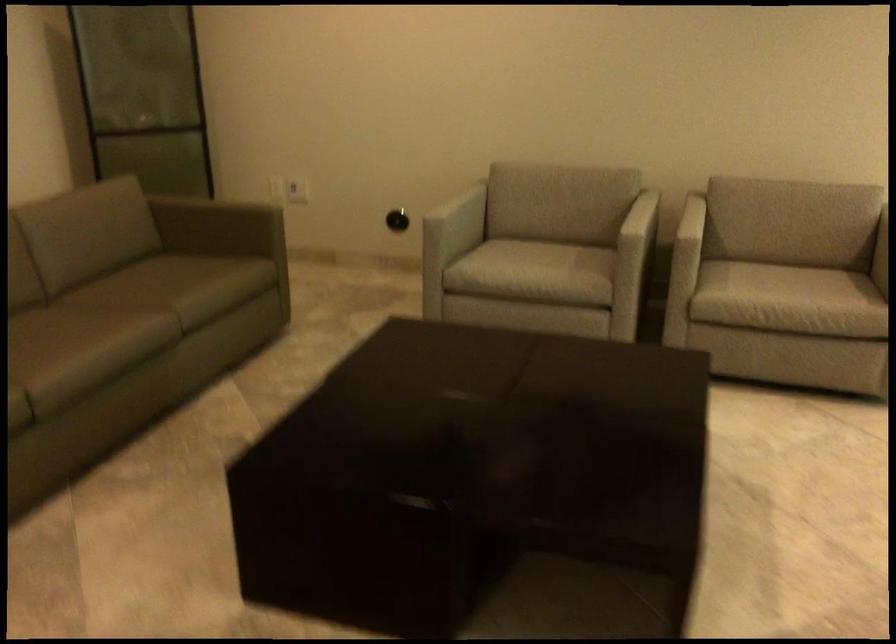
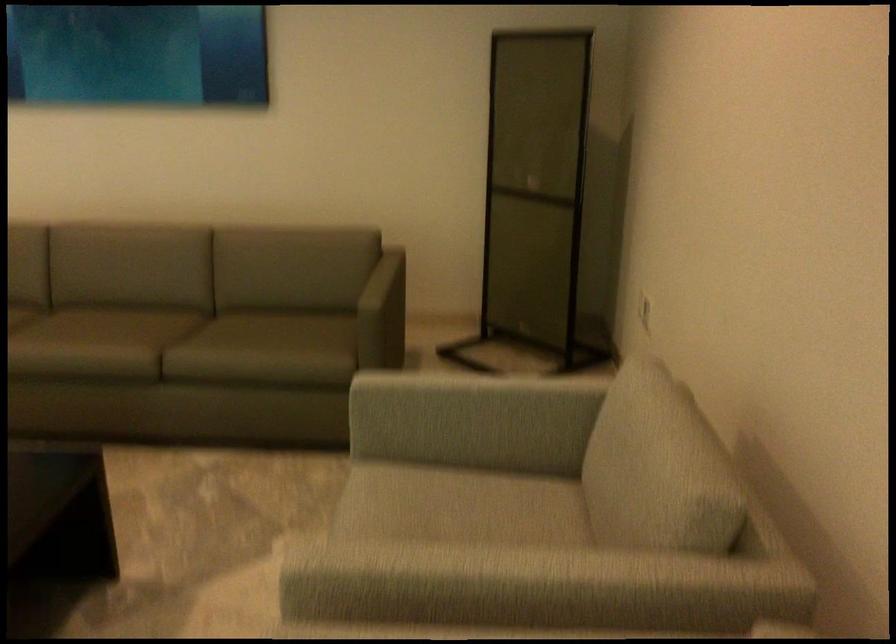
Find the pixel in the second image that matches (x=627, y=207) in the first image.

(479, 573)